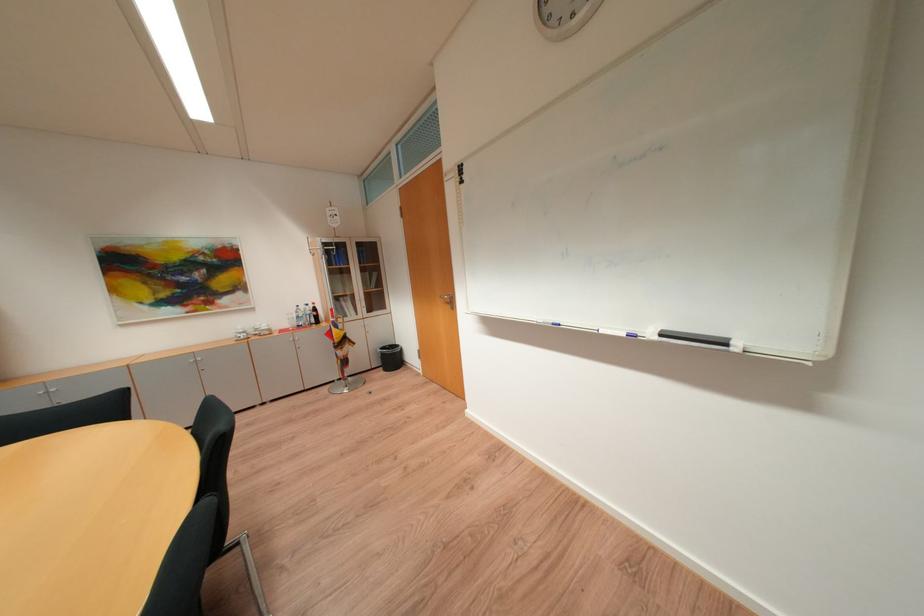
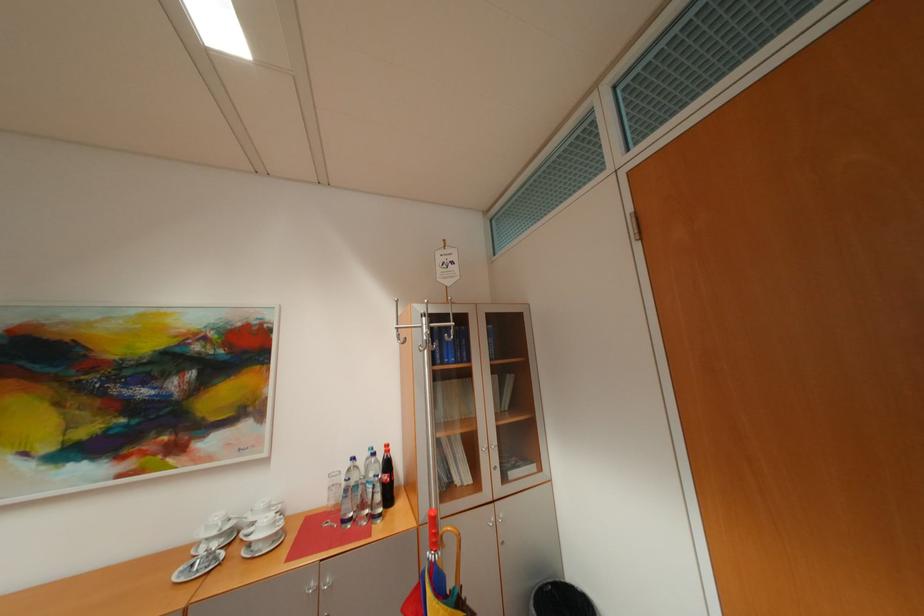
The images are taken continuously from a first-person perspective. In which direction are you moving?

The cameraman moved toward left, forward.